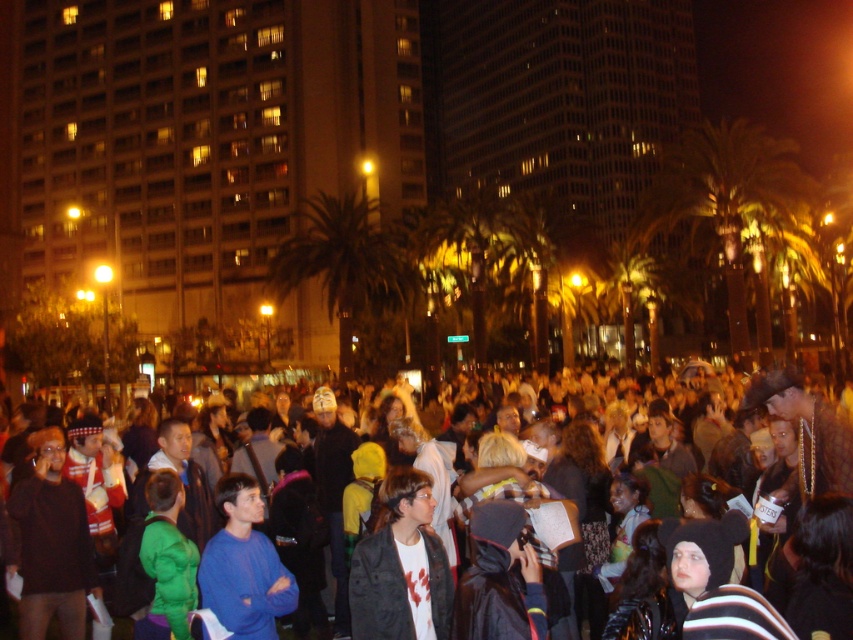
You are a photographer standing in the public square and want to take a picture of both the green leafy palm tree at right and the dark blue hoodie at center. Which object will appear larger in the photo?

The green leafy palm tree at right will appear larger in the photo because it is much taller than the dark blue hoodie at center.

You are a photographer trying to capture a photo of the crowd while ensuring the green leafy palm tree at center is visible in the background. Since the matte black jacket at center is blocking part of the view, can you estimate if the palm tree will still be mostly visible behind the jacket?

The matte black jacket at center is narrower than the green leafy palm tree at center, so the palm tree will likely still be mostly visible behind the jacket as the tree is wider.

Based on the photo, you are a photographer standing at the edge of the crowd in the public square. You want to take a photo that includes both the dark blue hoodie at center and the matte black jacket at center. Which of the two clothing items will appear larger in the photo?

The dark blue hoodie at center will appear larger in the photo because it is much taller than the matte black jacket at center.